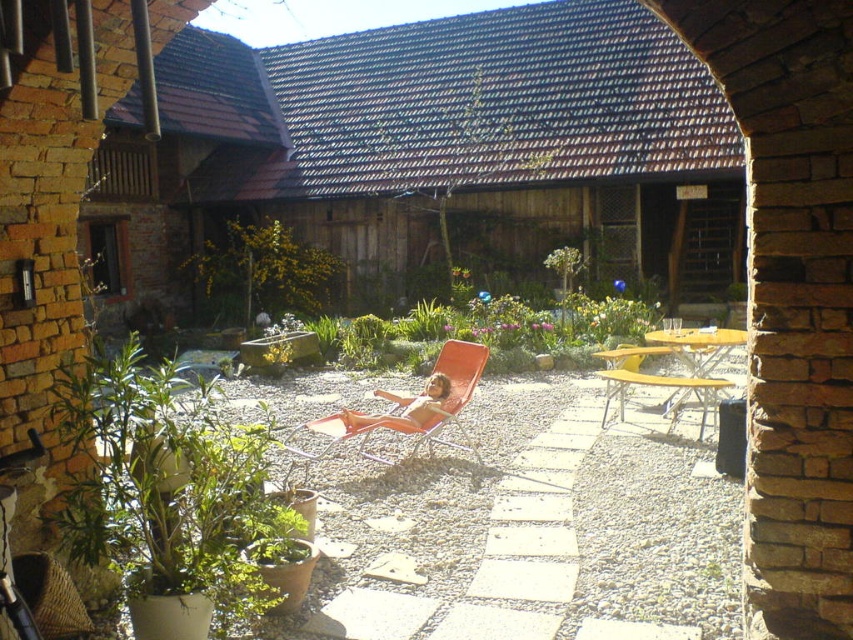
You are standing in the courtyard and want to reach both the orange mesh beach chair at center and the yellow plastic beach chair at center. Which one do you need to walk towards first to get to the one farther away?

You should first walk towards the orange mesh beach chair at center because it is closer to you, and then proceed to the yellow plastic beach chair at center which is farther away.

You are planning to place a small statue between the green leafy plant at lower left and the yellow plastic beach chair at center. Since the statue is 1 meter tall, will it be taller than either of these objects?

The green leafy plant at lower left is taller than the yellow plastic beach chair at center, but the exact heights are not provided. However, since the statue is 1 meter tall, it could potentially be taller than the yellow plastic beach chair at center if the plant is taller than 1 meter. Without specific measurements, we can only confirm that the statue may exceed the chair but not necessarily the plant.

You are standing at the point labeled point (343,416) in the courtyard. You want to walk straight ahead. Will you pass by the point labeled point (229,225) before or after reaching the brick wall with the window?

Since point (229,225) is behind point (343,416), walking straight ahead from point (343,416) would mean you would reach the brick wall with the window before passing by point (229,225).